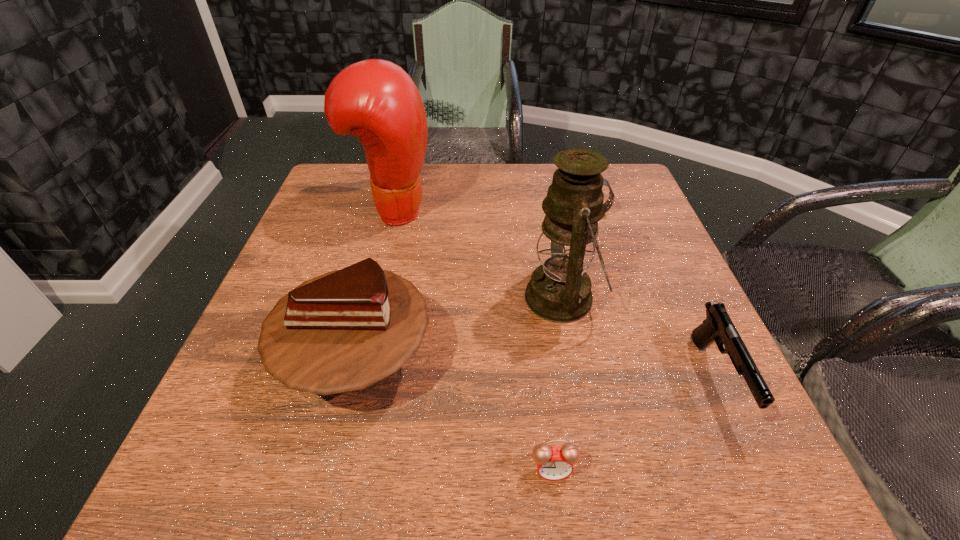
Locate an element on the screen. The width and height of the screenshot is (960, 540). blank area located at the aiming end of the rightmost object is located at coordinates (756, 467).

This screenshot has width=960, height=540. In order to click on free space located 0.280m on the face of the watch in this screenshot , I will do `click(463, 214)`.

Locate an element on the screen. Image resolution: width=960 pixels, height=540 pixels. vacant area situated 0.070m on the face of the watch is located at coordinates (x=543, y=214).

The height and width of the screenshot is (540, 960). In order to click on free space located 0.230m on the face of the watch in this screenshot , I will do `click(482, 214)`.

Where is `object that is at the far edge`? The width and height of the screenshot is (960, 540). object that is at the far edge is located at coordinates (375, 100).

Where is `object that is at the near edge`? The image size is (960, 540). object that is at the near edge is located at coordinates (553, 463).

You are a GUI agent. You are given a task and a screenshot of the screen. Output one action in this format:
    pyautogui.click(x=<x>, y=<y>)
    Task: Click on the boxing glove positioned at the left edge
    The width and height of the screenshot is (960, 540).
    Given the screenshot: What is the action you would take?
    pyautogui.click(x=375, y=100)

You are a GUI agent. You are given a task and a screenshot of the screen. Output one action in this format:
    pyautogui.click(x=<x>, y=<y>)
    Task: Click on the cake present at the left edge
    This screenshot has height=540, width=960.
    Given the screenshot: What is the action you would take?
    pyautogui.click(x=342, y=331)

Where is `gun that is positioned at the right edge`? gun that is positioned at the right edge is located at coordinates (718, 327).

Where is `watch located in the right edge section of the desktop`? The height and width of the screenshot is (540, 960). watch located in the right edge section of the desktop is located at coordinates (611, 199).